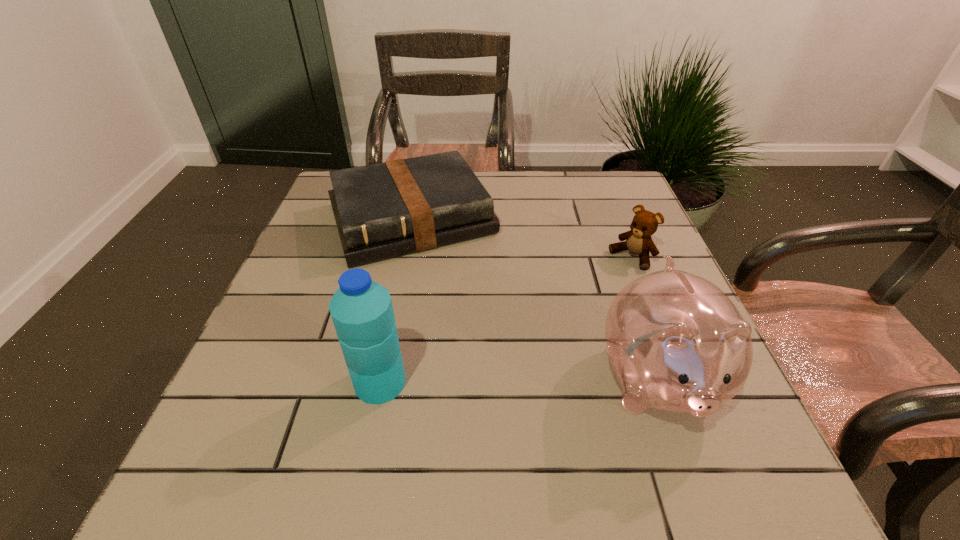
Where is `free spot between the teddy bear and the hardback book`? The height and width of the screenshot is (540, 960). free spot between the teddy bear and the hardback book is located at coordinates (521, 238).

Where is `vacant space that's between the piggy bank and the shortest object`? vacant space that's between the piggy bank and the shortest object is located at coordinates (535, 301).

Where is `the second closest object relative to the second shortest object`? This screenshot has width=960, height=540. the second closest object relative to the second shortest object is located at coordinates (385, 210).

Identify which object is the second nearest to the piggy bank. Please provide its 2D coordinates. Your answer should be formatted as a tuple, i.e. [(x, y)], where the tuple contains the x and y coordinates of a point satisfying the conditions above.

[(385, 210)]

Locate an element on the screen. Image resolution: width=960 pixels, height=540 pixels. free spot that satisfies the following two spatial constraints: 1. on the front side of the shortest object; 2. on the left side of the second shortest object is located at coordinates (404, 258).